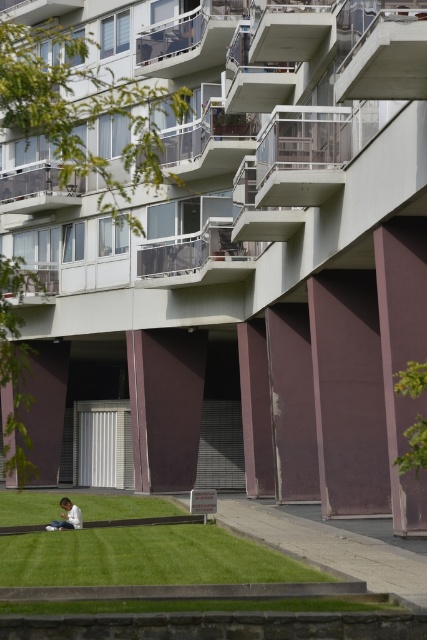
Which is above, green grass at lower center or glassy white balcony at upper left?

glassy white balcony at upper left

I want to click on green grass at lower center, so click(x=146, y=557).

You are a GUI agent. You are given a task and a screenshot of the screen. Output one action in this format:
    pyautogui.click(x=<x>, y=<y>)
    Task: Click on the green grass at lower center
    This screenshot has width=427, height=640.
    Given the screenshot: What is the action you would take?
    pyautogui.click(x=146, y=557)

In the scene shown: Is glassy white balcony at upper left taller than white cotton shirt at lower center?

Correct, glassy white balcony at upper left is much taller as white cotton shirt at lower center.

How far apart are glassy white balcony at upper left and white cotton shirt at lower center?

The distance of glassy white balcony at upper left from white cotton shirt at lower center is 17.78 meters.

Between point (49, 168) and point (69, 516), which one is positioned in front?

Point (69, 516) is in front.

This screenshot has height=640, width=427. Find the location of `glassy white balcony at upper left`. glassy white balcony at upper left is located at coordinates (37, 189).

The height and width of the screenshot is (640, 427). In order to click on green grass at lower center in this screenshot , I will do `click(146, 557)`.

Which is in front, point (225, 604) or point (61, 524)?

Point (225, 604) is more forward.

Locate an element on the screen. The height and width of the screenshot is (640, 427). green grass at lower center is located at coordinates (146, 557).